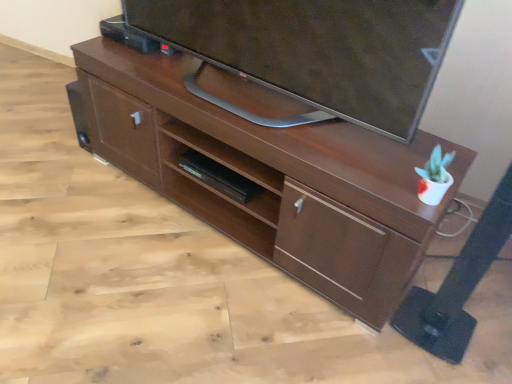
Find the location of a particular element. Image resolution: width=512 pixels, height=384 pixels. vacant point to the left of brown wood desk at center is located at coordinates [92, 223].